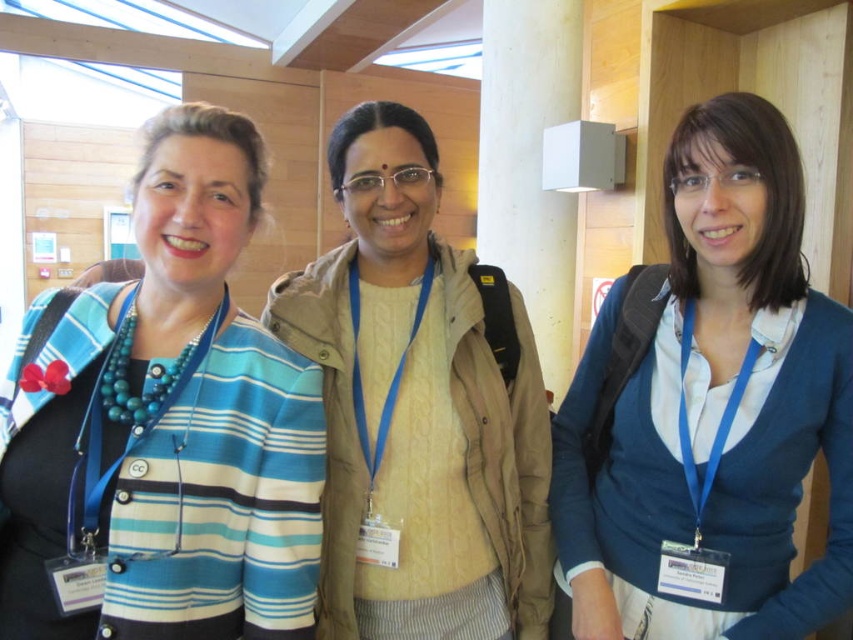
Question: Can you confirm if blue matte sweater at center is positioned above white matte wall at upper center?

Choices:
 (A) yes
 (B) no

Answer: (B)

Question: Which point appears farthest from the camera in this image?

Choices:
 (A) (549, 228)
 (B) (123, 342)
 (C) (325, 608)

Answer: (A)

Question: Can you confirm if blue matte sweater at center is positioned to the right of white matte wall at upper center?

Choices:
 (A) yes
 (B) no

Answer: (A)

Question: Is the position of blue matte sweater at center more distant than that of white matte wall at upper center?

Choices:
 (A) no
 (B) yes

Answer: (A)

Question: Among these points, which one is nearest to the camera?

Choices:
 (A) (511, 76)
 (B) (306, 497)
 (C) (619, 404)
 (D) (440, 529)

Answer: (B)

Question: Which object is positioned farthest from the white matte wall at upper center?

Choices:
 (A) blue striped cardigan at left
 (B) beige woolen sweater at center
 (C) blue matte sweater at center

Answer: (A)